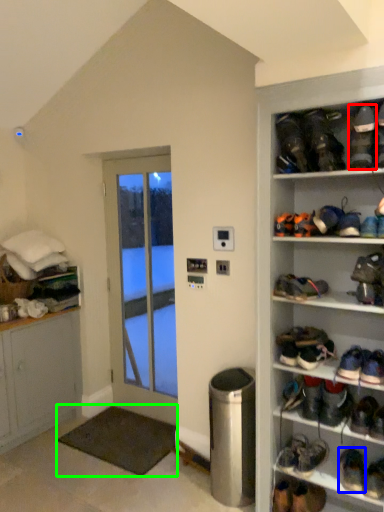
Question: Which object is positioned closest to footwear (highlighted by a red box)? Select from footwear (highlighted by a blue box) and carpetrack (highlighted by a green box).

Choices:
 (A) footwear
 (B) carpetrack

Answer: (A)